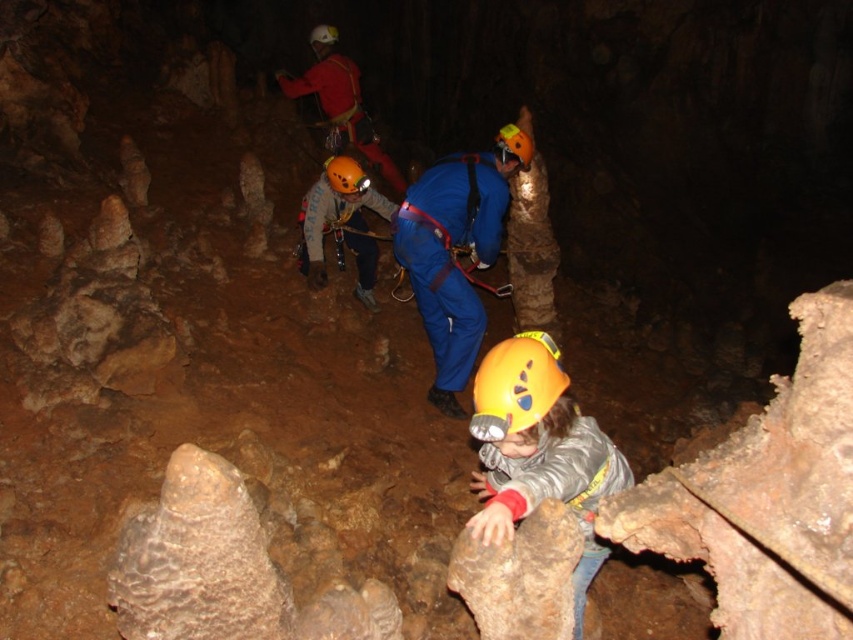
You are standing in the cave and want to reach the point marked at coordinates point (337, 164). If your maximum comfortable walking distance is 15 feet, will you be able to reach it without straining?

The point (337, 164) is 17.38 feet away from you, which exceeds your maximum comfortable walking distance of 15 feet. Therefore, reaching it would require some strain.

You are a caver in the dark cave and need to locate your teammates. You see the yellow matte helmet at center and the matte red jacket at upper center. Which object is positioned to the right side from your viewpoint?

The yellow matte helmet at center is to the right of the matte red jacket at upper center.

You are a member of the cave exploration team and need to pass a narrow passage that is 2 meters wide. You are currently standing near the matte blue jumpsuit at center. Can you safely pass through the passage without touching the matte red jacket at upper center?

The distance between the matte blue jumpsuit at center and the matte red jacket at upper center is 2.36 meters. Since the passage is 2 meters wide, you can safely pass through without touching the matte red jacket at upper center as there is enough space.